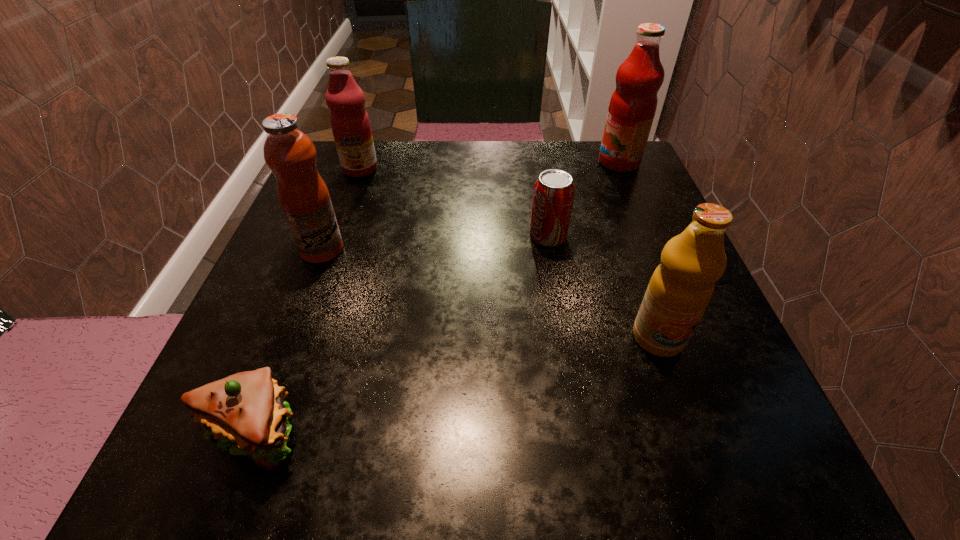
The image size is (960, 540). What are the coordinates of `empty space that is in between the fifth farthest object and the fourth object from left to right` in the screenshot? It's located at (603, 287).

Locate an element on the screen. This screenshot has width=960, height=540. unoccupied area between the fourth object from left to right and the sandwich is located at coordinates (400, 335).

The width and height of the screenshot is (960, 540). I want to click on object that ranks as the third closest to the second nearest object, so click(246, 411).

Identify the location of object that can be found as the third closest to the sandwich. This screenshot has width=960, height=540. (681, 287).

Select which fruit juice appears as the third closest to the third farthest fruit juice. Please provide its 2D coordinates. Your answer should be formatted as a tuple, i.e. [(x, y)], where the tuple contains the x and y coordinates of a point satisfying the conditions above.

[(632, 107)]

This screenshot has height=540, width=960. Identify the location of fruit juice that can be found as the closest to the second nearest object. (632, 107).

The image size is (960, 540). I want to click on vacant space that satisfies the following two spatial constraints: 1. on the front label of the nearest object; 2. on the right side of the third farthest fruit juice, so click(x=252, y=433).